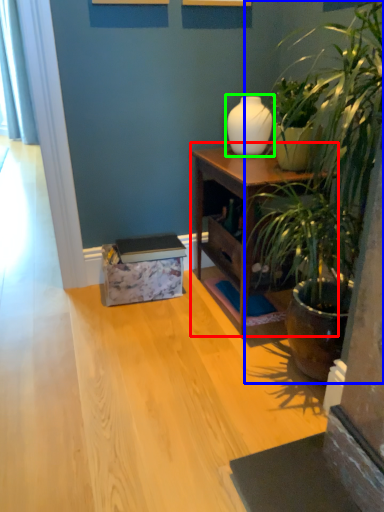
Question: Considering the real-world distances, which object is closest to nightstand (highlighted by a red box)? houseplant (highlighted by a blue box) or vase (highlighted by a green box).

Choices:
 (A) houseplant
 (B) vase

Answer: (B)